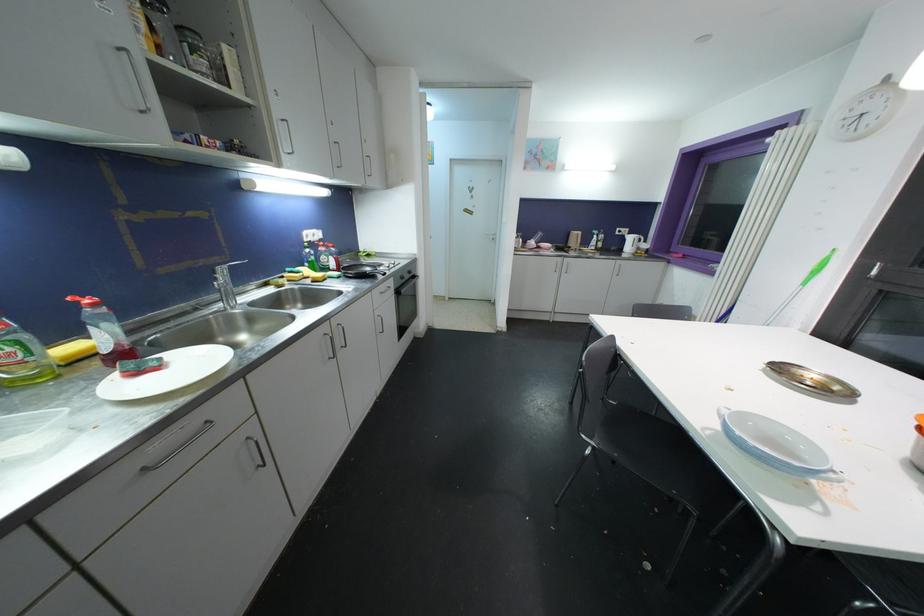
This screenshot has height=616, width=924. In order to click on oven door handle in this screenshot , I will do `click(411, 284)`.